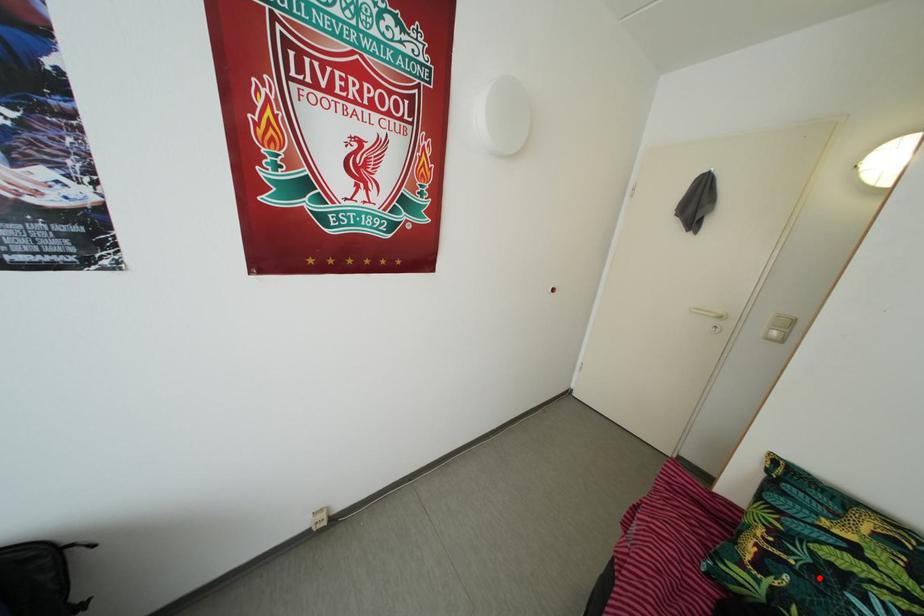
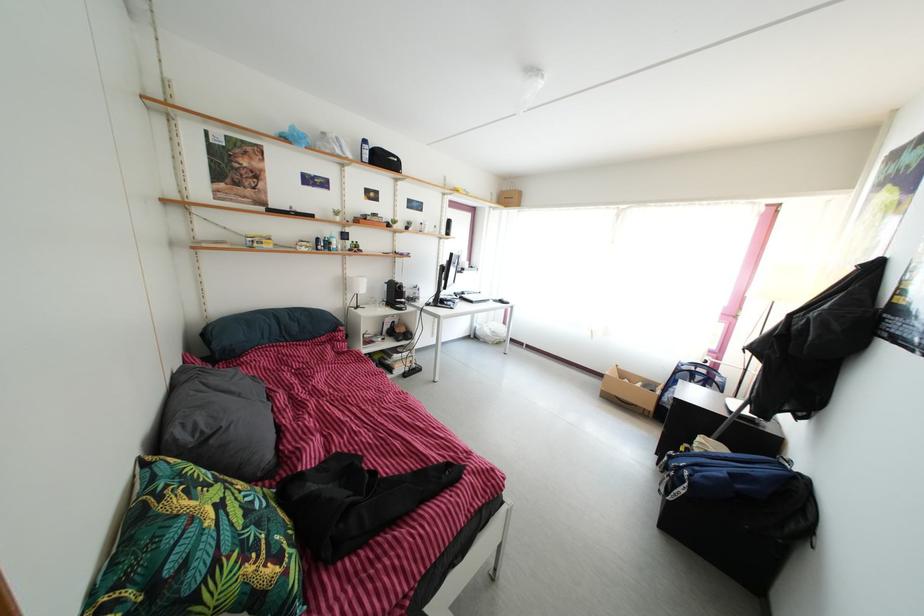
Locate, in the second image, the point that corresponds to the highlighted location in the first image.

(264, 533)